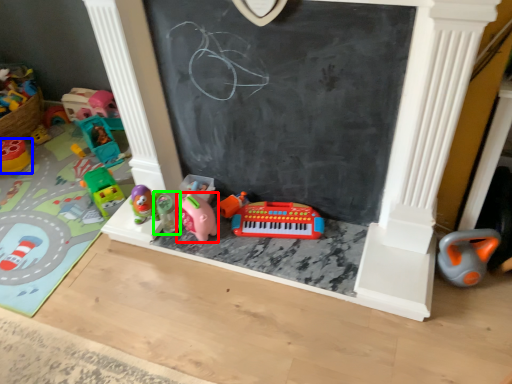
Question: Based on their relative distances, which object is farther from toy (highlighted by a red box)? Choose from toy (highlighted by a blue box) and toy (highlighted by a green box).

Choices:
 (A) toy
 (B) toy

Answer: (A)